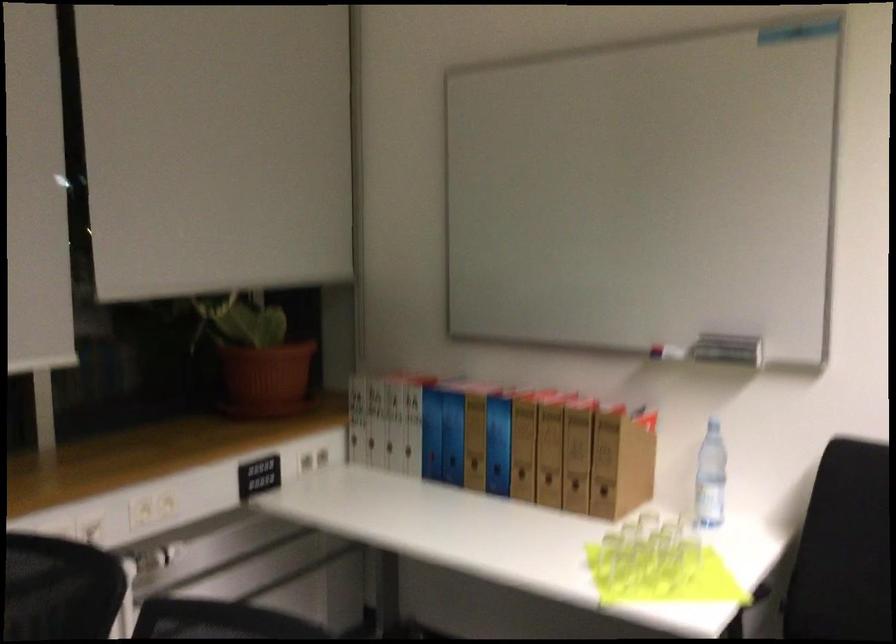
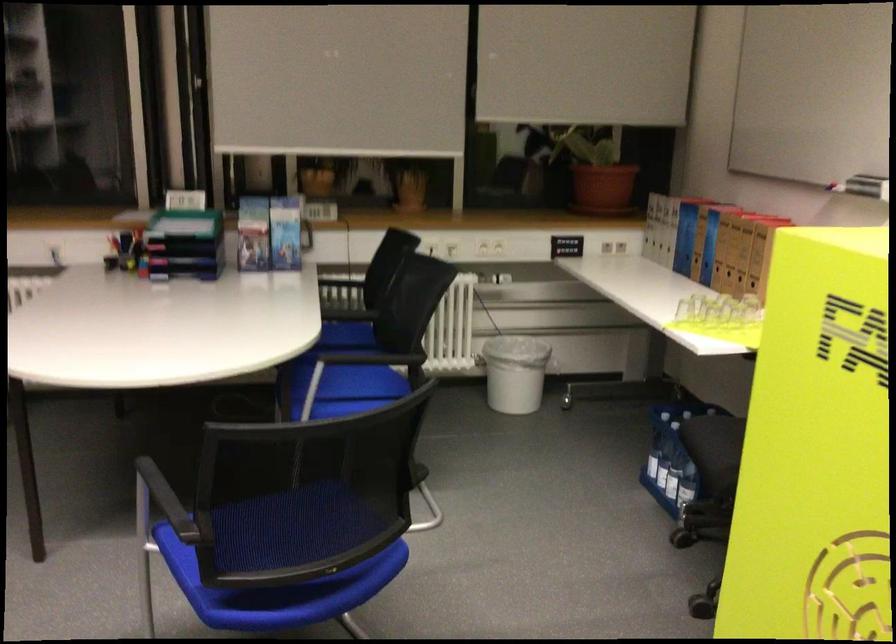
Where in the second image is the point corresponding to pixel 446 440 from the first image?

(685, 238)